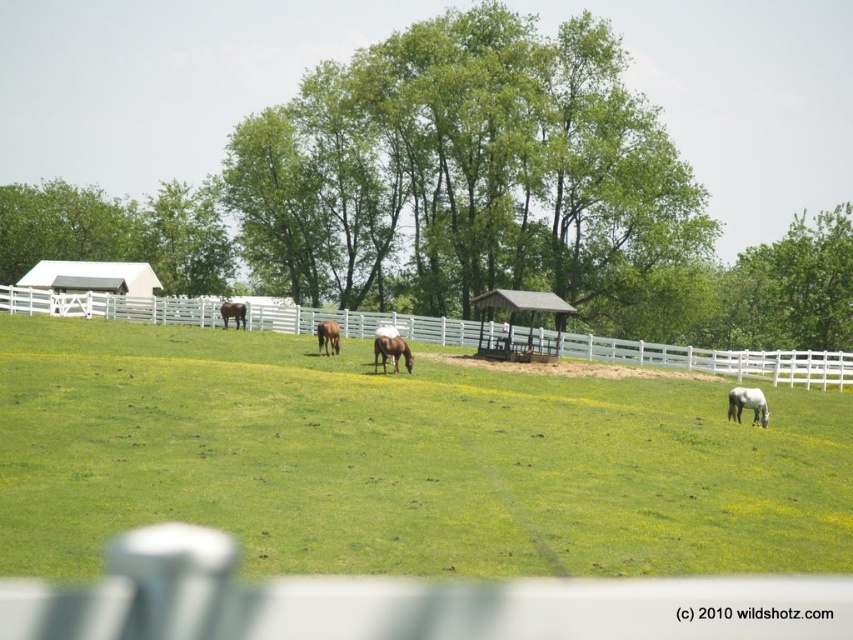
Is white wooden fence at center above brown glossy horse at center?

Yes, white wooden fence at center is above brown glossy horse at center.

Who is more forward, (x=10, y=301) or (x=393, y=346)?

Point (x=393, y=346) is in front.

I want to click on white wooden fence at center, so [x=718, y=360].

Is green leafy tree at center taller than brown glossy horse at center?

Indeed, green leafy tree at center has a greater height compared to brown glossy horse at center.

The width and height of the screenshot is (853, 640). What do you see at coordinates (462, 198) in the screenshot?
I see `green leafy tree at center` at bounding box center [462, 198].

This screenshot has width=853, height=640. I want to click on green leafy tree at center, so click(x=462, y=198).

Does white glossy horse at lower right appear on the left side of brown glossy horse at center?

Incorrect, white glossy horse at lower right is not on the left side of brown glossy horse at center.

Find the location of a particular element. white glossy horse at lower right is located at coordinates (747, 404).

You are a GUI agent. You are given a task and a screenshot of the screen. Output one action in this format:
    pyautogui.click(x=<x>, y=<y>)
    Task: Click on the white glossy horse at lower right
    The image size is (853, 640).
    Given the screenshot: What is the action you would take?
    pyautogui.click(x=747, y=404)